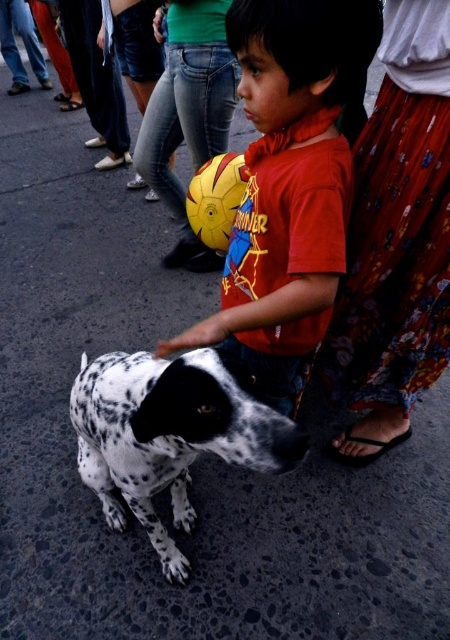
Question: Can you confirm if matte red t-shirt at center is bigger than spotted fur dog at lower left?

Choices:
 (A) yes
 (B) no

Answer: (A)

Question: Is matte red t-shirt at center positioned in front of spotted fur dog at lower left?

Choices:
 (A) yes
 (B) no

Answer: (B)

Question: Which object appears farthest from the camera in this image?

Choices:
 (A) matte red t-shirt at center
 (B) spotted fur dog at lower left

Answer: (A)

Question: Can you confirm if matte red t-shirt at center is positioned above spotted fur dog at lower left?

Choices:
 (A) yes
 (B) no

Answer: (A)

Question: Which point is farther to the camera?

Choices:
 (A) matte red t-shirt at center
 (B) spotted fur dog at lower left

Answer: (A)